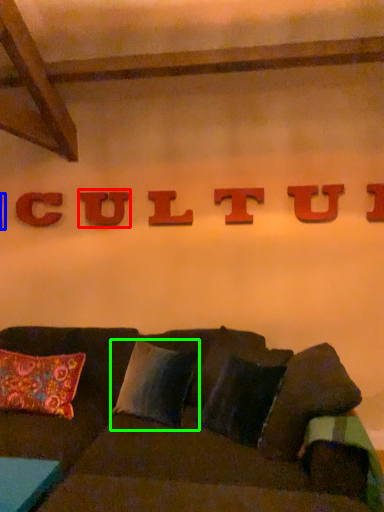
Question: Which object is the farthest from letter (highlighted by a red box)? Choose among these: letter (highlighted by a blue box) or pillow (highlighted by a green box).

Choices:
 (A) letter
 (B) pillow

Answer: (B)